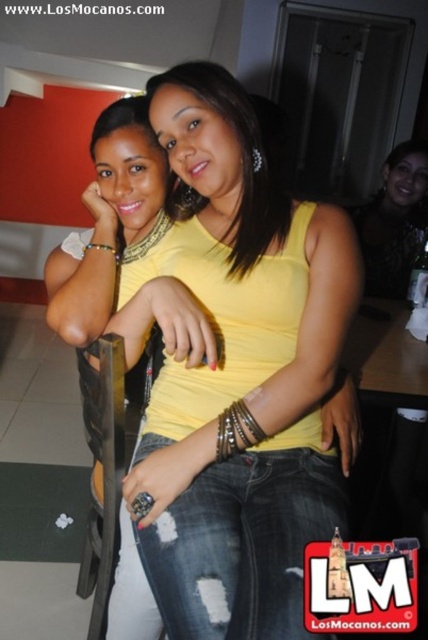
Question: From the image, what is the correct spatial relationship of matte black top at upper right in relation to metallic black chair at lower left?

Choices:
 (A) right
 (B) left

Answer: (A)

Question: Can you confirm if ripped denim jeans at center is smaller than matte black top at upper right?

Choices:
 (A) yes
 (B) no

Answer: (B)

Question: Considering the real-world distances, which object is farthest from the yellow matte tank top at center?

Choices:
 (A) metallic black chair at lower left
 (B) matte black top at upper right
 (C) ripped denim jeans at center

Answer: (B)

Question: Can you confirm if yellow matte tank top at center is positioned to the left of matte black top at upper right?

Choices:
 (A) yes
 (B) no

Answer: (A)

Question: Which object is the closest to the matte black top at upper right?

Choices:
 (A) ripped denim jeans at center
 (B) metallic black chair at lower left
 (C) yellow matte tank top at center

Answer: (C)

Question: Which is nearer to the yellow matte tank top at center?

Choices:
 (A) ripped denim jeans at center
 (B) metallic black chair at lower left
 (C) matte black top at upper right

Answer: (A)